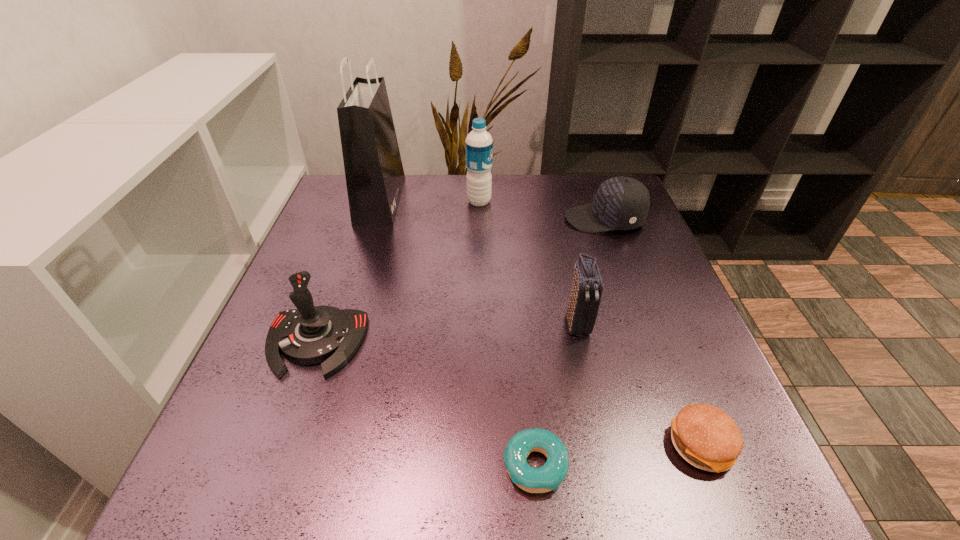
In the image, there is a desktop. In order to click on vacant space at the far edge in this screenshot , I will do `click(426, 193)`.

Find the location of a particular element. The width and height of the screenshot is (960, 540). free space at the near edge of the desktop is located at coordinates (312, 463).

At what (x,y) coordinates should I click in order to perform the action: click on free space at the left edge. Please return your answer as a coordinate pair (x, y). Looking at the image, I should click on (327, 305).

You are a GUI agent. You are given a task and a screenshot of the screen. Output one action in this format:
    pyautogui.click(x=<x>, y=<y>)
    Task: Click on the vacant space at the right edge
    The image size is (960, 540).
    Given the screenshot: What is the action you would take?
    pyautogui.click(x=619, y=279)

Image resolution: width=960 pixels, height=540 pixels. Find the location of `vacant space at the far left corner`. vacant space at the far left corner is located at coordinates (343, 186).

You are a GUI agent. You are given a task and a screenshot of the screen. Output one action in this format:
    pyautogui.click(x=<x>, y=<y>)
    Task: Click on the unoccupied position between the hamburger and the shopping bag
    This screenshot has height=540, width=960.
    Given the screenshot: What is the action you would take?
    pyautogui.click(x=541, y=323)

Identify the location of free area in between the shopping bag and the clutch bag. (479, 262).

I want to click on free space between the shortest object and the clutch bag, so click(556, 394).

This screenshot has height=540, width=960. In order to click on free space that is in between the water bottle and the joystick in this screenshot , I will do `click(397, 272)`.

This screenshot has height=540, width=960. In order to click on empty location between the baseball cap and the joystick in this screenshot , I will do `click(460, 281)`.